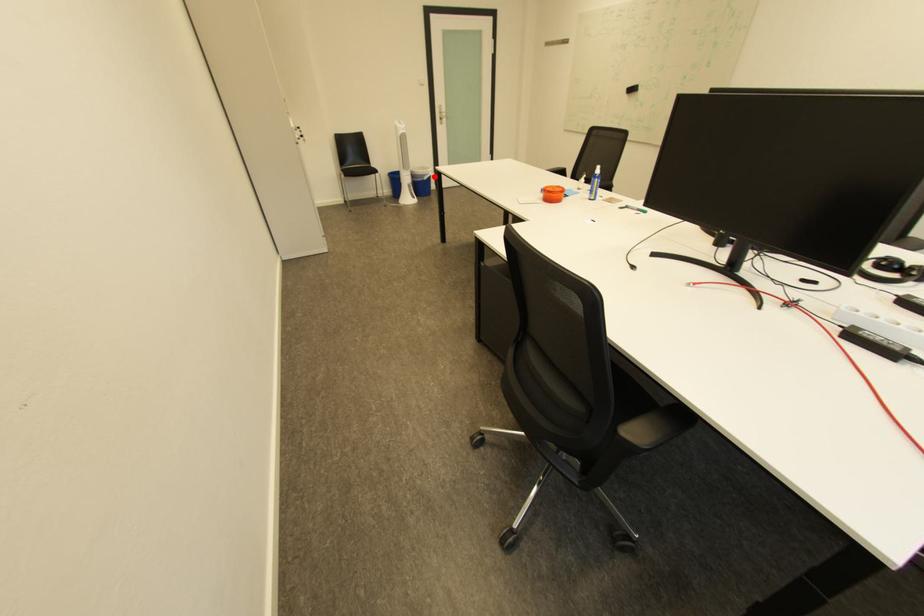
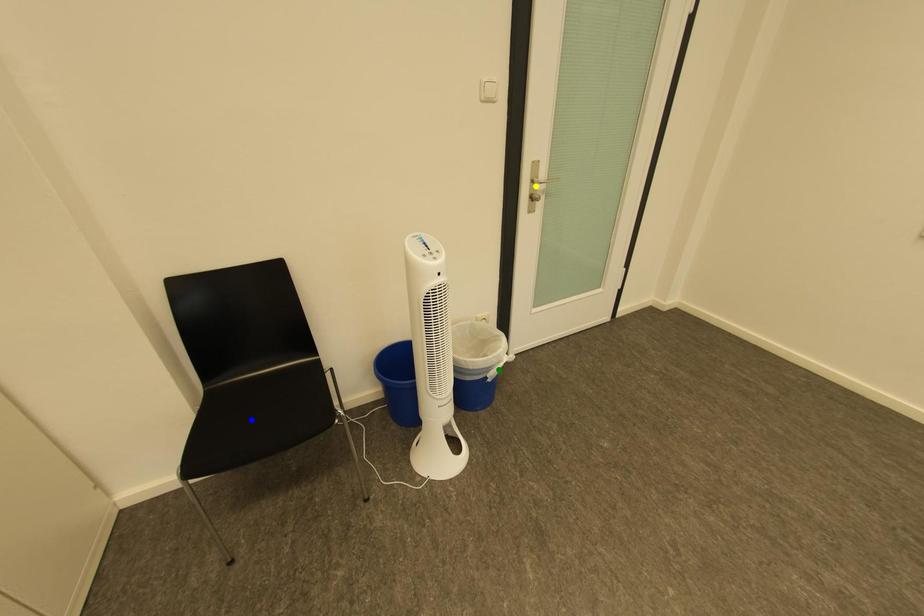
Question: I am providing you with two images of the same scene from different viewpoints. A red point is marked on the first image. You are given multiple points on the second image. In image 2, which mark is for the same physical point as the one in image 1?

Choices:
 (A) blue point
 (B) green point
 (C) yellow point

Answer: (B)